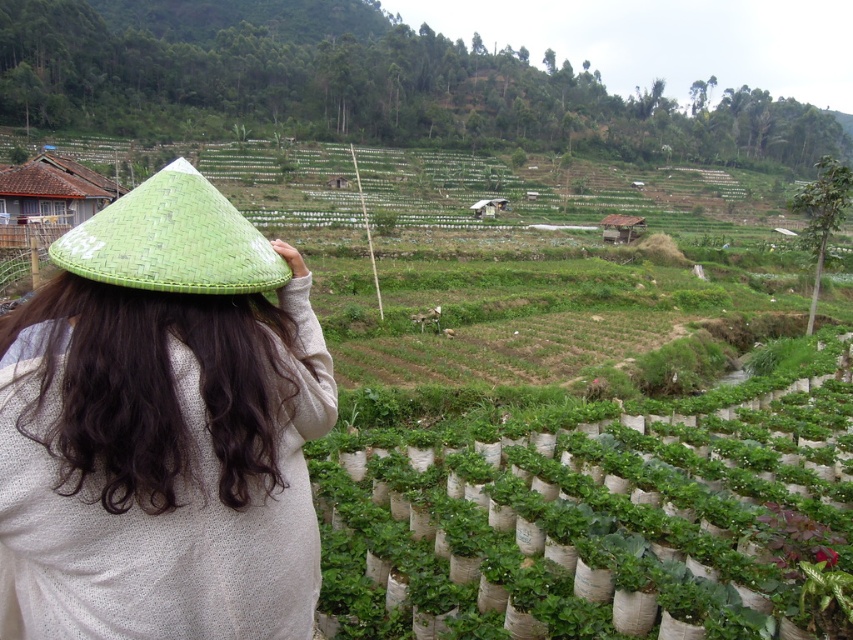
You are a farmer checking the growth of your crops. You notice the green leafy plants at center and the green woven straw hat at upper left. Which object occupies more horizontal space in the image?

The green leafy plants at center might be wider than the green woven straw hat at upper left, so they likely occupy more horizontal space.